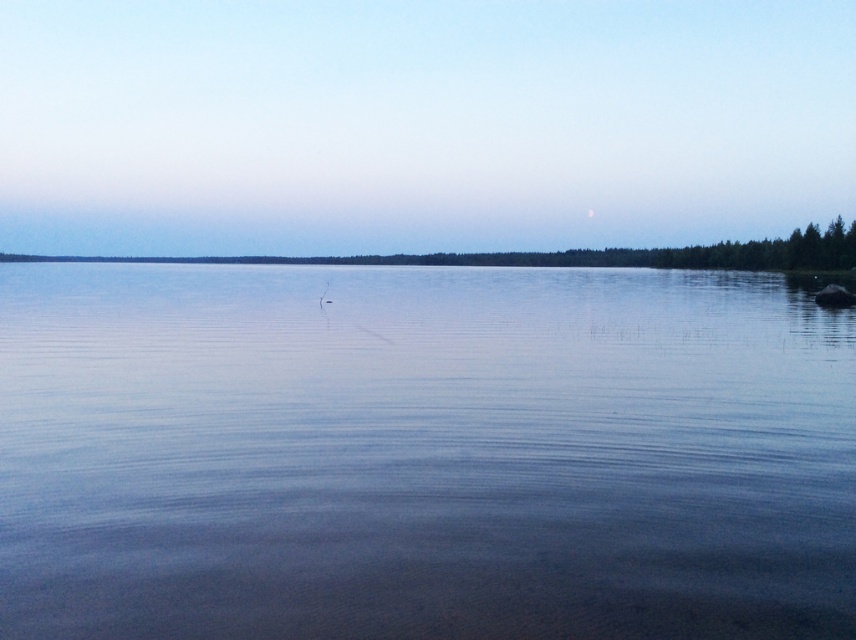
You are a drone operator who needs to fly a drone from the transparent water at center to the blue sky at upper center. What is the approximate distance you need to cover?

The distance between the transparent water at center and the blue sky at upper center is approximately 387.99 feet, so the drone operator needs to cover around 388 feet.

You are standing on the lakeside and looking at the scene. Which object, the transparent water at center or the blue sky at upper center, is positioned to the right of the other?

The transparent water at center is to the right of the blue sky at upper center.

In the scene shown: You are standing on the lakeshore and looking at the scene. Which object is directly above the other between the transparent water at center and the blue sky at upper center?

The blue sky at upper center is directly above the transparent water at center.